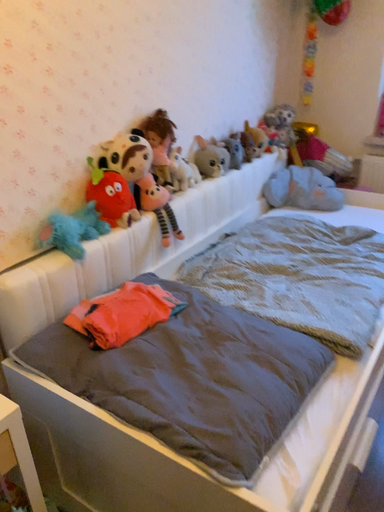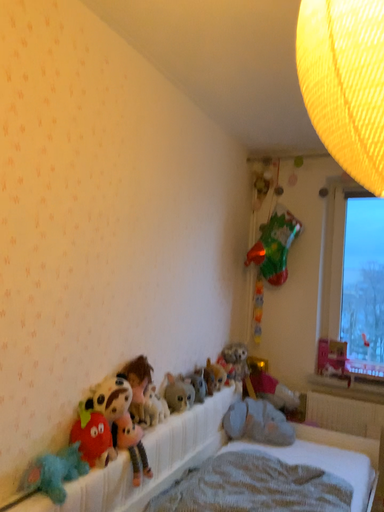
Question: How did the camera likely rotate when shooting the video?

Choices:
 (A) rotated right
 (B) rotated left

Answer: (A)